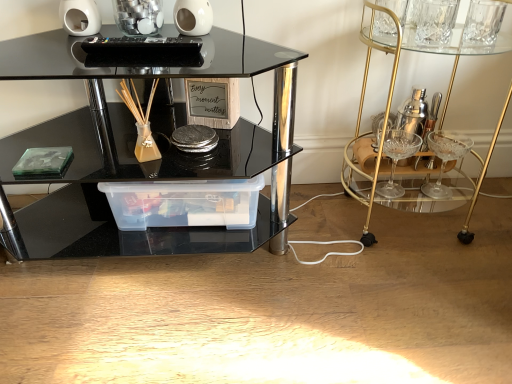
The height and width of the screenshot is (384, 512). Find the location of `vacant space in front of gold glass bar cart at right`. vacant space in front of gold glass bar cart at right is located at coordinates (417, 286).